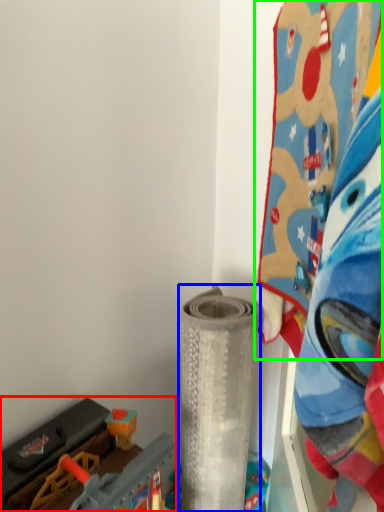
Question: Which object is positioned farthest from toy (highlighted by a red box)? Select from toy (highlighted by a blue box) and toy (highlighted by a green box).

Choices:
 (A) toy
 (B) toy

Answer: (B)